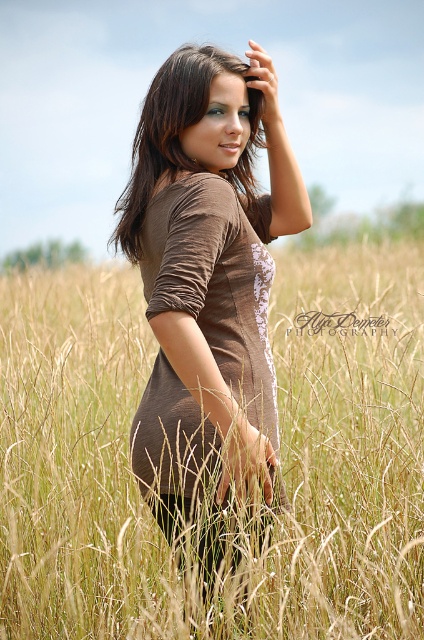
Question: Which point is closer to the camera?

Choices:
 (A) brown shiny hair at center
 (B) golden wheat field at center
 (C) brown textured dress at center
 (D) brown matte dress at center

Answer: (D)

Question: Does golden wheat field at center lie behind brown textured dress at center?

Choices:
 (A) yes
 (B) no

Answer: (B)

Question: Is golden wheat field at center further to camera compared to brown shiny hair at center?

Choices:
 (A) no
 (B) yes

Answer: (A)

Question: Is golden wheat field at center wider than brown matte dress at center?

Choices:
 (A) yes
 (B) no

Answer: (A)

Question: Considering the real-world distances, which object is closest to the brown textured dress at center?

Choices:
 (A) brown matte dress at center
 (B) golden wheat field at center

Answer: (A)

Question: Among these objects, which one is nearest to the camera?

Choices:
 (A) brown matte dress at center
 (B) brown shiny hair at center
 (C) brown textured dress at center

Answer: (A)